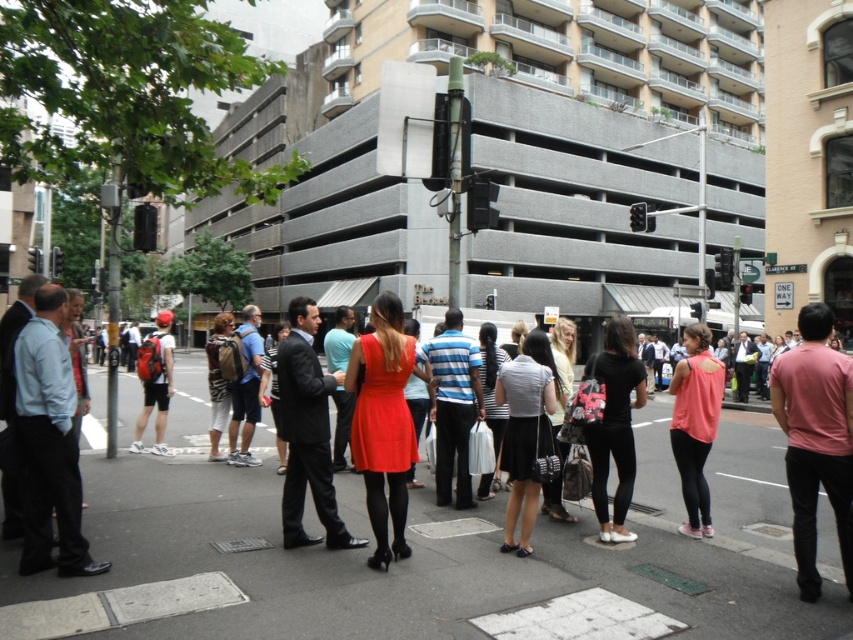
Consider the image. You are a delivery person carrying a box that is 2 meters long. You need to walk between the matte red dress at center and the matte black suit at center. Is there enough space for you to pass through without moving either of them?

The distance between the matte red dress at center and the matte black suit at center is 2.20 meters. Since your box is 2 meters long, there is enough space to pass through without moving either of them.

You are a delivery person carrying a 3.5 meter long tube that needs to be transported through the narrowest path between the matte black suit at center and the matte black backpack at center. Can you safely pass through this path without bending the tube?

The distance between the matte black suit at center and the matte black backpack at center is 4.02 meters. Since the tube is 3.5 meters long, it can fit through the path as the available space is slightly larger than the tube.

You are a photographer standing at the edge of the sidewalk in the bustling urban street scene. You want to capture a photo that includes both the man in the dark suit and the woman in the bright red dress. The man is at point [816,470] and the woman is at point [318,371]. Which of these two points is closer to your position as the photographer?

Point [816,470] is closer to the viewer than point [318,371]. Therefore, the man at point [816,470] is closer to your position as the photographer.